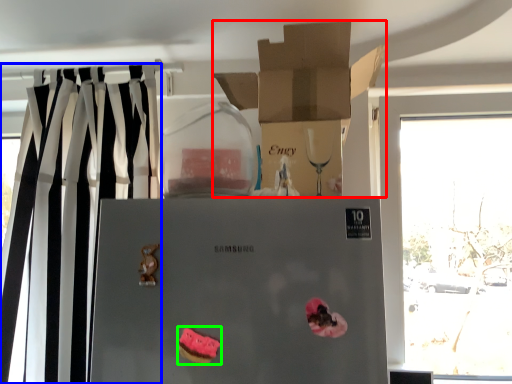
Question: Which object is positioned farthest from box (highlighted by a red box)? Select from curtain (highlighted by a blue box) and stuff (highlighted by a green box).

Choices:
 (A) curtain
 (B) stuff

Answer: (B)